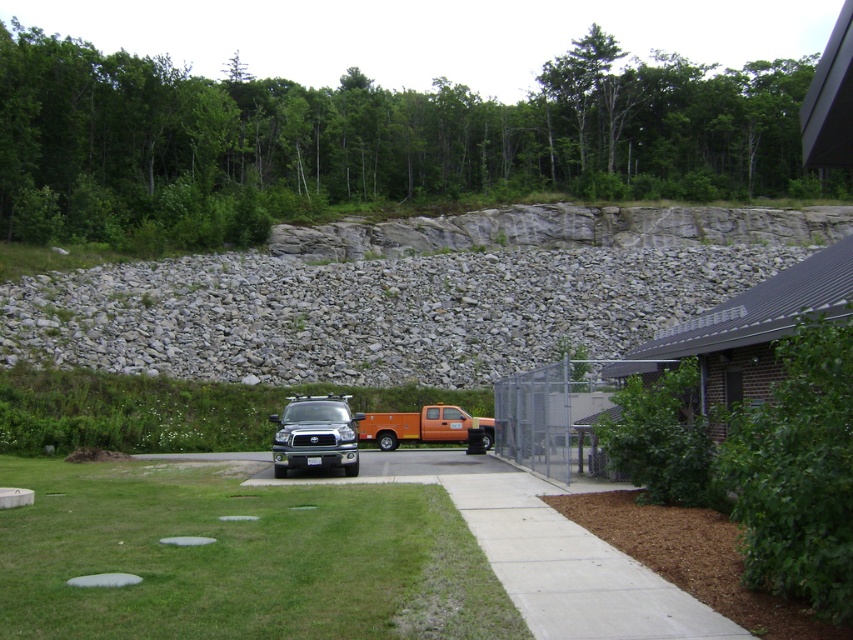
Can you confirm if matte black truck at center is positioned to the left of orange matte truck at center?

Yes, matte black truck at center is to the left of orange matte truck at center.

Which is in front, point (317, 413) or point (379, 448)?

Point (317, 413)

You are a GUI agent. You are given a task and a screenshot of the screen. Output one action in this format:
    pyautogui.click(x=<x>, y=<y>)
    Task: Click on the matte black truck at center
    The height and width of the screenshot is (640, 853).
    Given the screenshot: What is the action you would take?
    pyautogui.click(x=315, y=435)

From the picture: Which of these two, green grass at lower left or matte black truck at center, stands shorter?

green grass at lower left is shorter.

In the scene shown: Is green grass at lower left wider than matte black truck at center?

Indeed, green grass at lower left has a greater width compared to matte black truck at center.

The width and height of the screenshot is (853, 640). What do you see at coordinates (238, 557) in the screenshot? I see `green grass at lower left` at bounding box center [238, 557].

The height and width of the screenshot is (640, 853). I want to click on green grass at lower left, so 238,557.

Between green grass at lower left and orange matte truck at center, which one has less height?

orange matte truck at center

Is point (35, 477) in front of point (376, 442)?

Yes, it is in front of point (376, 442).

The height and width of the screenshot is (640, 853). What do you see at coordinates (238, 557) in the screenshot?
I see `green grass at lower left` at bounding box center [238, 557].

The image size is (853, 640). Identify the location of green grass at lower left. tap(238, 557).